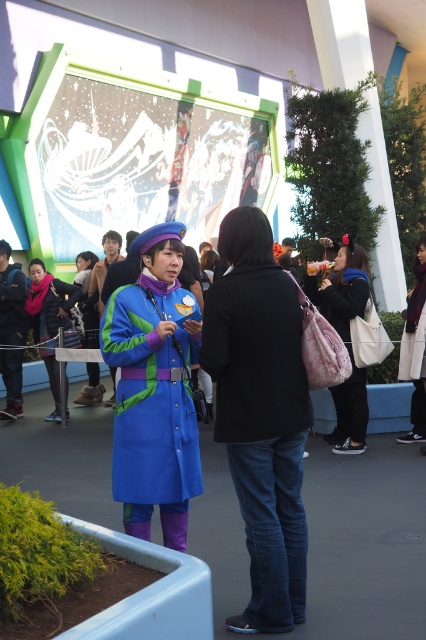
Question: Does matte pink fabric bag at right have a smaller size compared to white cotton dress at center?

Choices:
 (A) yes
 (B) no

Answer: (B)

Question: Considering the real-world distances, which object is closest to the black matte coat at center?

Choices:
 (A) white cotton dress at center
 (B) matte pink fabric bag at right
 (C) black matte jacket at center

Answer: (C)

Question: Which point is closer to the camera taking this photo?

Choices:
 (A) (60, 294)
 (B) (158, 492)

Answer: (B)

Question: Which object is positioned closest to the blue fabric coat at center?

Choices:
 (A) black matte coat at center
 (B) black matte jacket at center

Answer: (A)

Question: Is matte blue coat at center below matte black jacket at center?

Choices:
 (A) no
 (B) yes

Answer: (B)

Question: Is matte black jacket at center wider than blue fabric coat at center?

Choices:
 (A) yes
 (B) no

Answer: (A)